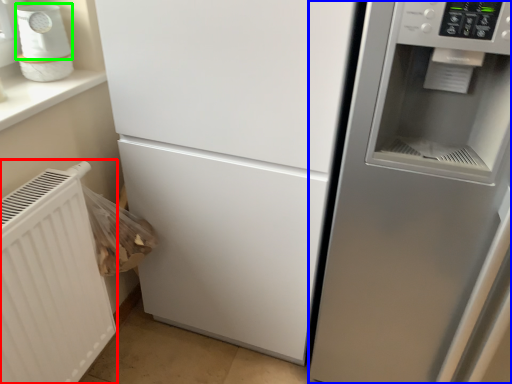
Question: Based on their relative distances, which object is nearer to radiator (highlighted by a red box)? Choose from fridge (highlighted by a blue box) and appliance (highlighted by a green box).

Choices:
 (A) fridge
 (B) appliance

Answer: (B)